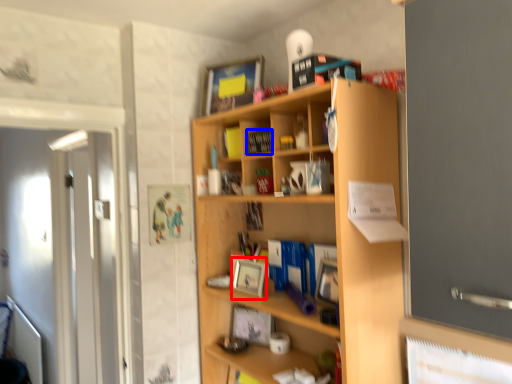
Question: Among these objects, which one is farthest to the camera, picture frame (highlighted by a red box) or book (highlighted by a blue box)?

Choices:
 (A) picture frame
 (B) book

Answer: (B)